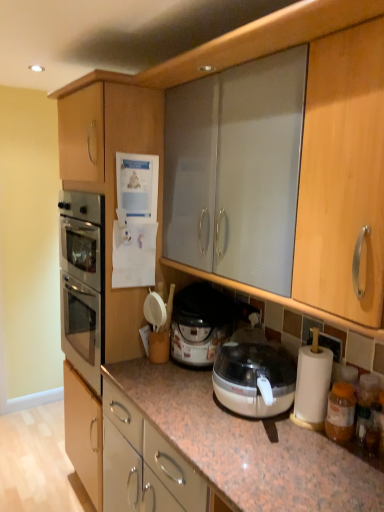
Question: Can you confirm if matte wood cabinet at left is wider than translucent plastic rice cooker at center?

Choices:
 (A) yes
 (B) no

Answer: (A)

Question: Is matte wood cabinet at left at the left side of translucent plastic rice cooker at center?

Choices:
 (A) yes
 (B) no

Answer: (A)

Question: Can you see matte wood cabinet at left touching translucent plastic rice cooker at center?

Choices:
 (A) no
 (B) yes

Answer: (A)

Question: From the image's perspective, is matte wood cabinet at left on top of translucent plastic rice cooker at center?

Choices:
 (A) yes
 (B) no

Answer: (A)

Question: Is matte wood cabinet at left completely or partially outside of translucent plastic rice cooker at center?

Choices:
 (A) no
 (B) yes

Answer: (B)

Question: From the image's perspective, is matte wood cabinet at left located beneath translucent plastic rice cooker at center?

Choices:
 (A) yes
 (B) no

Answer: (B)

Question: Is translucent plastic rice cooker at center facing away from matte wood cabinet at left?

Choices:
 (A) yes
 (B) no

Answer: (B)

Question: Is translucent plastic rice cooker at center behind matte wood cabinet at left?

Choices:
 (A) no
 (B) yes

Answer: (B)

Question: Is translucent plastic rice cooker at center completely or partially outside of matte wood cabinet at left?

Choices:
 (A) no
 (B) yes

Answer: (B)

Question: Can you confirm if translucent plastic rice cooker at center is wider than matte wood cabinet at left?

Choices:
 (A) no
 (B) yes

Answer: (A)

Question: Is translucent plastic rice cooker at center oriented towards matte wood cabinet at left?

Choices:
 (A) yes
 (B) no

Answer: (B)

Question: Is translucent plastic rice cooker at center shorter than matte wood cabinet at left?

Choices:
 (A) no
 (B) yes

Answer: (B)

Question: From the image's perspective, relative to matte wood cabinet at left, is translucent plastic rice cooker at center above or below?

Choices:
 (A) above
 (B) below

Answer: (B)